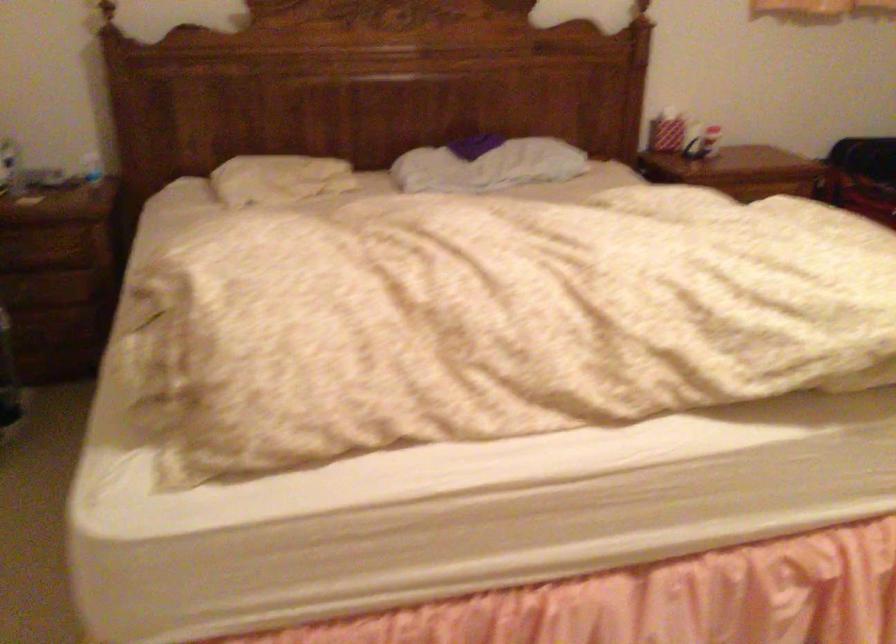
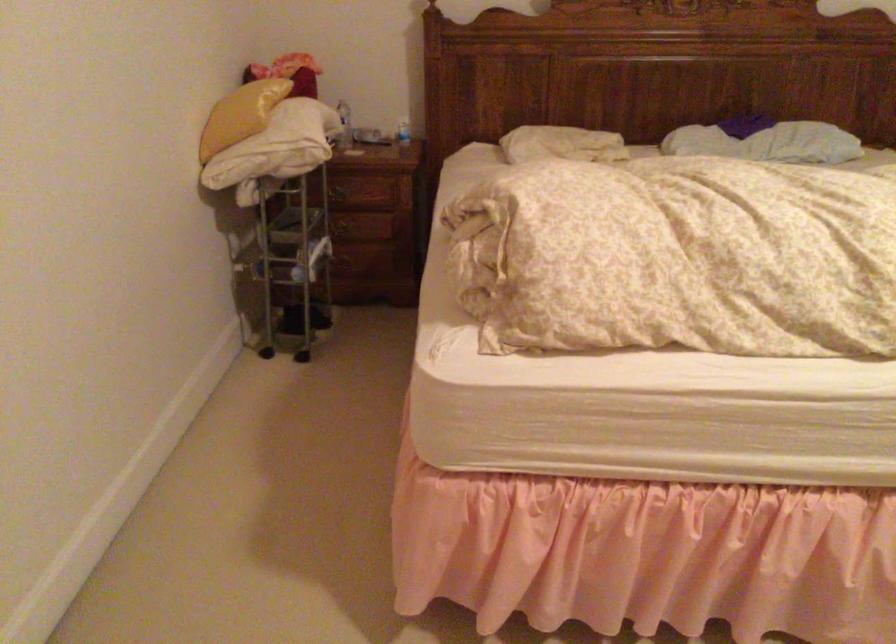
In the second image, find the point that corresponds to (273,185) in the first image.

(561, 144)